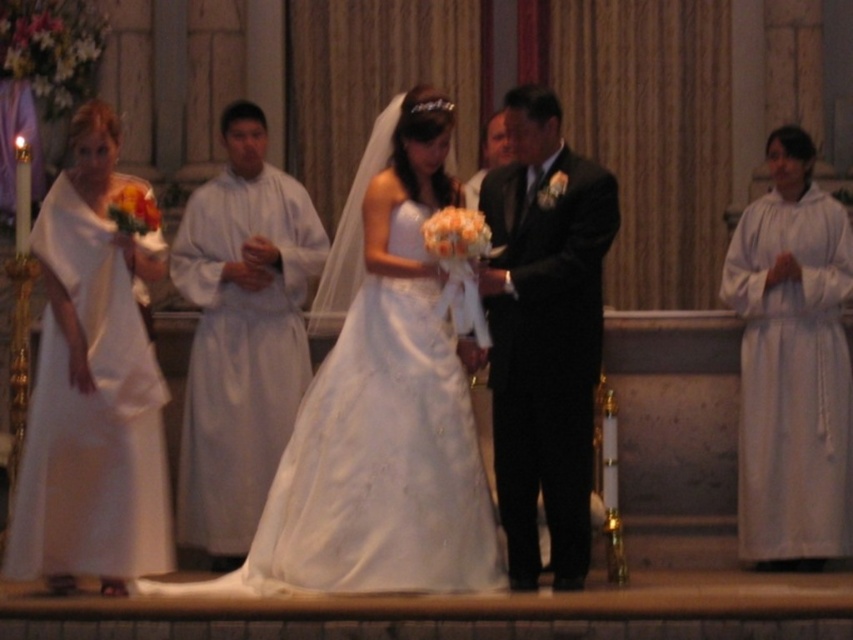
Question: In this image, where is shiny black suit at center located relative to white cloth at right?

Choices:
 (A) below
 (B) above

Answer: (A)

Question: Which point appears closest to the camera in this image?

Choices:
 (A) (39, 211)
 (B) (289, 330)
 (C) (260, 572)
 (D) (538, 464)

Answer: (C)

Question: Observing the image, what is the correct spatial positioning of matte white dress at left in reference to white cloth at right?

Choices:
 (A) left
 (B) right

Answer: (A)

Question: Can you confirm if matte white dress at left is positioned to the right of shiny black suit at center?

Choices:
 (A) no
 (B) yes

Answer: (A)

Question: Which point appears closest to the camera in this image?

Choices:
 (A) (386, 548)
 (B) (762, 301)
 (C) (570, 403)

Answer: (A)

Question: Which point is farther to the camera?

Choices:
 (A) matte white dress at left
 (B) white cloth at left
 (C) shiny black suit at center
 (D) white cloth at right

Answer: (B)